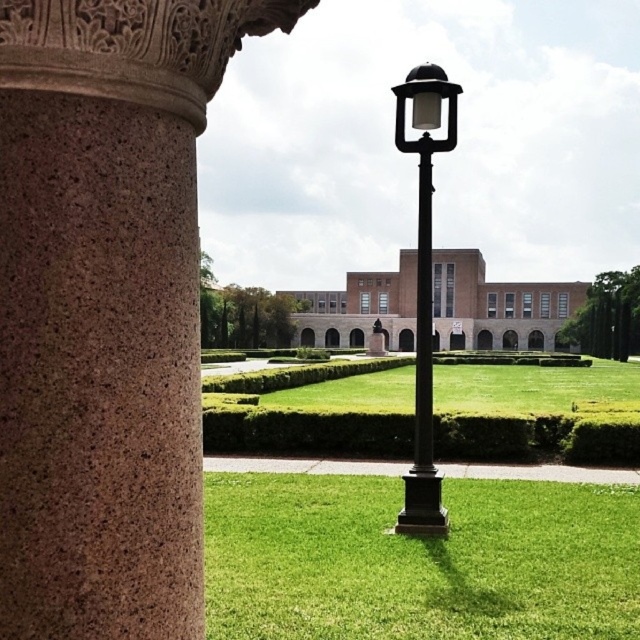
Does brown speckled stone column at left appear under black polished metal lamp post at center?

Indeed, brown speckled stone column at left is positioned under black polished metal lamp post at center.

Is brown speckled stone column at left shorter than black polished metal lamp post at center?

Indeed, brown speckled stone column at left has a lesser height compared to black polished metal lamp post at center.

Does point (22, 202) come in front of point (426, 522)?

Yes, it is.

Where is `brown speckled stone column at left`? The height and width of the screenshot is (640, 640). brown speckled stone column at left is located at coordinates (104, 308).

Who is higher up, green grass at center or black polished metal lamp post at center?

black polished metal lamp post at center is higher up.

Can you confirm if green grass at center is positioned to the left of black polished metal lamp post at center?

Correct, you'll find green grass at center to the left of black polished metal lamp post at center.

Between point (554, 589) and point (433, 124), which one is positioned behind?

The point (433, 124) is more distant.

Identify the location of green grass at center. The width and height of the screenshot is (640, 640). (419, 561).

Who is positioned more to the right, brown speckled stone column at left or green grass at center?

green grass at center

Which is below, brown speckled stone column at left or green grass at center?

green grass at center is lower down.

Who is more forward, (54, 392) or (589, 634)?

Point (54, 392) is more forward.

The image size is (640, 640). I want to click on brown speckled stone column at left, so click(x=104, y=308).